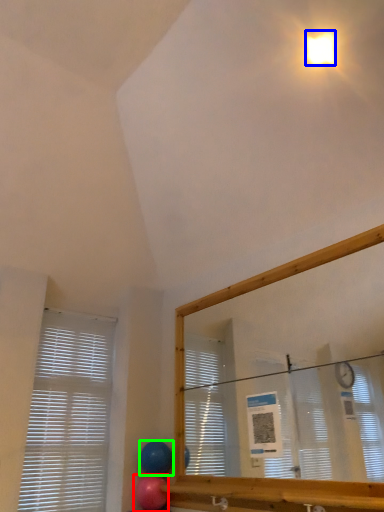
Question: Which is nearer to the balloon (highlighted by a red box)? light (highlighted by a blue box) or balloon (highlighted by a green box).

Choices:
 (A) light
 (B) balloon

Answer: (B)